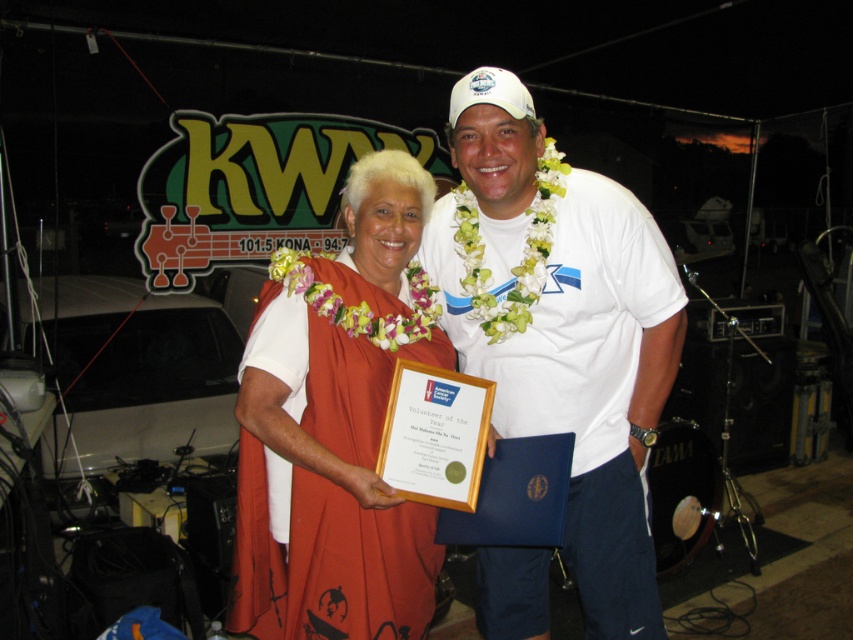
Question: Does white t-shirt at center appear on the left side of orange fabric dress at center?

Choices:
 (A) no
 (B) yes

Answer: (A)

Question: From the image, what is the correct spatial relationship of white t-shirt at center in relation to orange fabric dress at center?

Choices:
 (A) above
 (B) below

Answer: (A)

Question: Among these objects, which one is nearest to the camera?

Choices:
 (A) orange fabric dress at center
 (B) white t-shirt at center

Answer: (A)

Question: Is white t-shirt at center thinner than orange fabric dress at center?

Choices:
 (A) yes
 (B) no

Answer: (B)